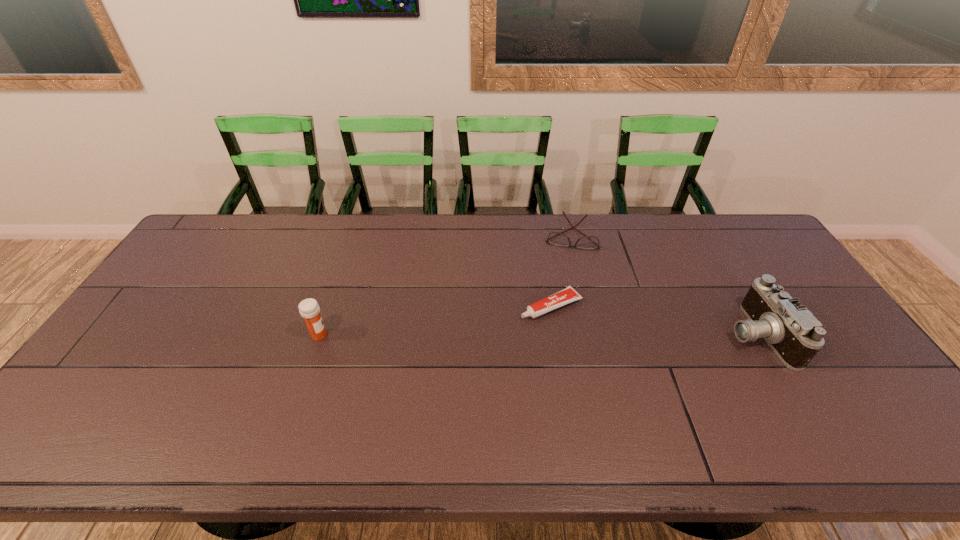
Where is `vacant space that is in between the farthest object and the leftmost object`? Image resolution: width=960 pixels, height=540 pixels. vacant space that is in between the farthest object and the leftmost object is located at coordinates (444, 286).

I want to click on free space between the toothpaste and the rightmost object, so click(x=654, y=320).

Locate an element on the screen. Image resolution: width=960 pixels, height=540 pixels. free space between the rightmost object and the farthest object is located at coordinates (662, 286).

Locate an element on the screen. The image size is (960, 540). object that can be found as the closest to the spectacles is located at coordinates (567, 295).

Identify the location of object that is the third closest to the farthest object. (309, 309).

The image size is (960, 540). Find the location of `free space that satisfies the following two spatial constraints: 1. on the front side of the camera; 2. at the lens of the shortest object`. free space that satisfies the following two spatial constraints: 1. on the front side of the camera; 2. at the lens of the shortest object is located at coordinates (556, 335).